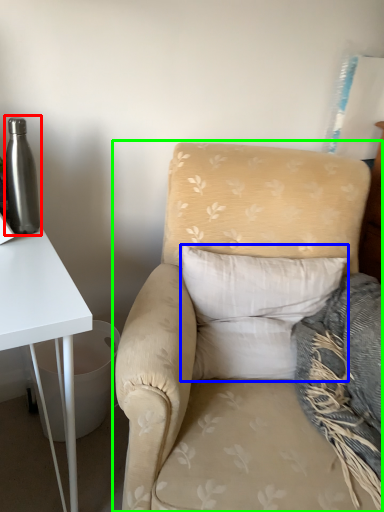
Question: Considering the real-world distances, which object is farthest from bottle (highlighted by a red box)? pillow (highlighted by a blue box) or chair (highlighted by a green box)?

Choices:
 (A) pillow
 (B) chair

Answer: (A)